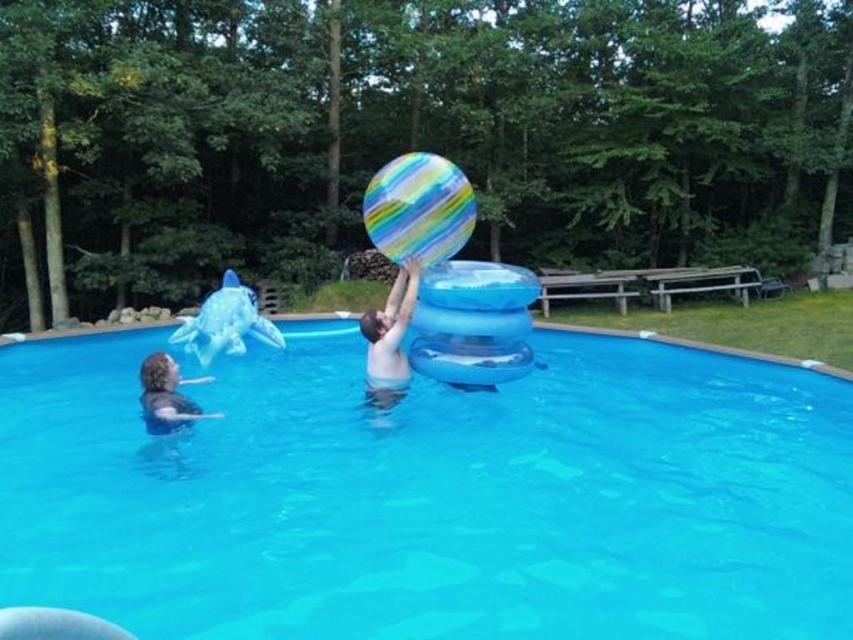
Which is behind, point (395, 321) or point (148, 422)?

Point (395, 321)

Which is more to the right, smooth skin man at center or dark gray shirt at lower left?

smooth skin man at center is more to the right.

The height and width of the screenshot is (640, 853). What do you see at coordinates (389, 340) in the screenshot? I see `smooth skin man at center` at bounding box center [389, 340].

Identify the location of smooth skin man at center. The image size is (853, 640). (389, 340).

Is transparent blue pool at center in front of smooth skin man at center?

Yes, transparent blue pool at center is closer to the viewer.

Does transparent blue pool at center appear on the left side of smooth skin man at center?

No, transparent blue pool at center is not to the left of smooth skin man at center.

Is point (641, 465) closer to camera compared to point (367, 371)?

That is True.

The image size is (853, 640). Find the location of `transparent blue pool at center`. transparent blue pool at center is located at coordinates (434, 497).

Does multicolored striped beach ball at center appear on the right side of dark gray shirt at lower left?

Indeed, multicolored striped beach ball at center is positioned on the right side of dark gray shirt at lower left.

Does multicolored striped beach ball at center have a greater width compared to dark gray shirt at lower left?

No, multicolored striped beach ball at center is not wider than dark gray shirt at lower left.

Does point (370, 180) come behind point (158, 378)?

Yes, it is.

Identify the location of multicolored striped beach ball at center. The height and width of the screenshot is (640, 853). (418, 209).